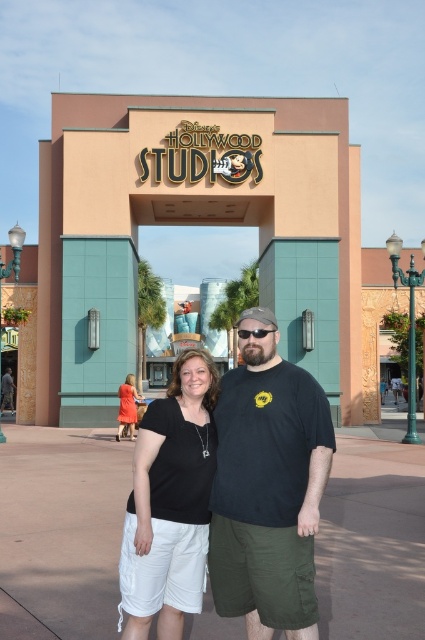
Between beige concrete entrance at center and matte orange dress at lower left, which one is positioned lower?

matte orange dress at lower left

Is beige concrete entrance at center closer to camera compared to matte orange dress at lower left?

No.

Which is in front, point (132, 284) or point (133, 381)?

Positioned in front is point (133, 381).

Identify the location of beige concrete entrance at center. The height and width of the screenshot is (640, 425). (195, 225).

Is black cotton t-shirt at center positioned behind matte orange dress at lower left?

No, it is in front of matte orange dress at lower left.

Who is shorter, black cotton t-shirt at center or matte orange dress at lower left?

matte orange dress at lower left is shorter.

Does point (226, 477) come behind point (130, 413)?

No, it is in front of (130, 413).

Locate an element on the screen. Image resolution: width=425 pixels, height=640 pixels. black cotton t-shirt at center is located at coordinates point(268,486).

Is black cotton t-shirt at center shorter than black cotton shirt at center?

Incorrect, black cotton t-shirt at center's height does not fall short of black cotton shirt at center's.

From the picture: Can you confirm if black cotton t-shirt at center is smaller than black cotton shirt at center?

Yes.

Image resolution: width=425 pixels, height=640 pixels. Identify the location of black cotton t-shirt at center. (268, 486).